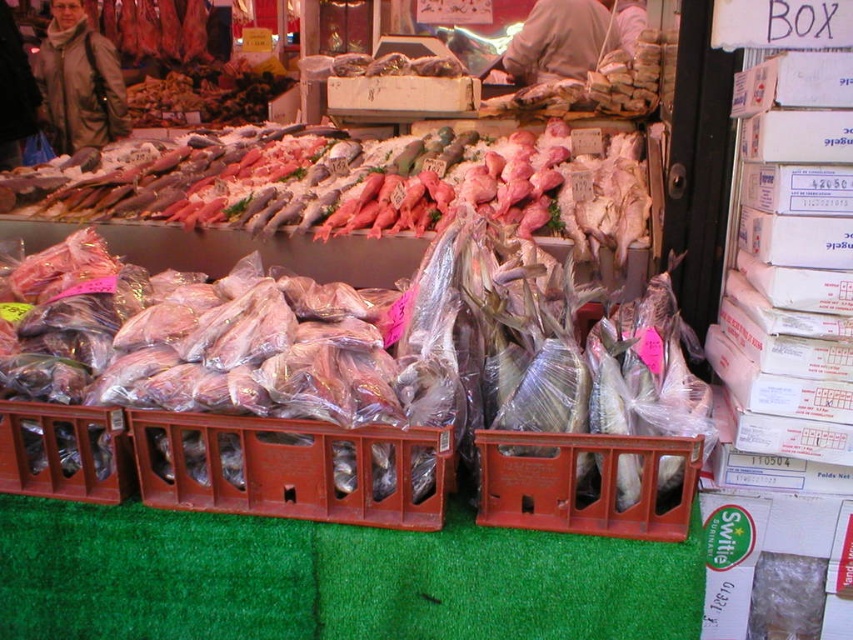
Between point (202, 417) and point (498, 486), which one is positioned behind?

The point (498, 486) is more distant.

Is point (427, 500) positioned behind point (677, 451)?

Yes, it is behind point (677, 451).

This screenshot has width=853, height=640. What are the coordinates of `brown plastic crate at center` in the screenshot? It's located at (289, 468).

Which is below, orange plastic crate at center or leather jacket at upper left?

orange plastic crate at center is lower down.

In the scene shown: How distant is orange plastic crate at center from leather jacket at upper left?

orange plastic crate at center is 5.26 meters away from leather jacket at upper left.

Find the location of a particular element. This screenshot has width=853, height=640. orange plastic crate at center is located at coordinates (579, 483).

Is brown plastic crate at center wider than leather jacket at upper left?

No.

Which is behind, point (163, 486) or point (65, 61)?

Positioned behind is point (65, 61).

The width and height of the screenshot is (853, 640). I want to click on brown plastic crate at center, so click(x=289, y=468).